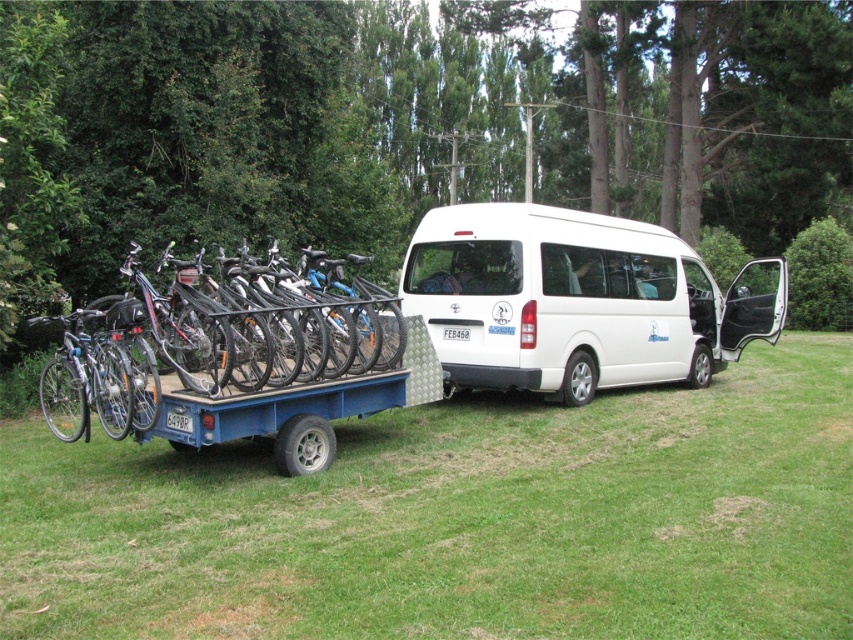
Who is taller, green grass at lower center or matte black bicycle at left?

With more height is matte black bicycle at left.

What are the coordinates of `green grass at lower center` in the screenshot? It's located at (460, 518).

Can you confirm if white matte van at center is shorter than matte black bicycle at left?

No, white matte van at center is not shorter than matte black bicycle at left.

Which is below, white matte van at center or matte black bicycle at left?

matte black bicycle at left

Is point (527, 282) closer to camera compared to point (126, 371)?

No.

Where is `white matte van at center`? This screenshot has width=853, height=640. white matte van at center is located at coordinates (577, 300).

Between point (88, 339) and point (117, 364), which one is positioned in front?

Point (117, 364) is more forward.

Is matte black bicycle at left above shiny metallic bicycle at left?

Yes, matte black bicycle at left is above shiny metallic bicycle at left.

The image size is (853, 640). Find the location of `matte black bicycle at left`. matte black bicycle at left is located at coordinates (207, 364).

You are a GUI agent. You are given a task and a screenshot of the screen. Output one action in this format:
    pyautogui.click(x=<x>, y=<y>)
    Task: Click on the matte black bicycle at left
    Image resolution: width=853 pixels, height=640 pixels.
    Given the screenshot: What is the action you would take?
    pyautogui.click(x=207, y=364)